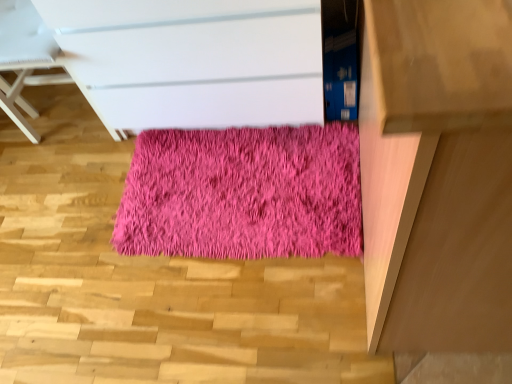
Question: Based on their sizes in the image, would you say shaggy pink rug at center is bigger or smaller than light brown wooden table at right?

Choices:
 (A) small
 (B) big

Answer: (A)

Question: From a real-world perspective, relative to light brown wooden table at right, is shaggy pink rug at center vertically above or below?

Choices:
 (A) below
 (B) above

Answer: (A)

Question: Which of these objects is positioned closest to the matte white chest of drawers at center?

Choices:
 (A) shaggy pink rug at center
 (B) pink fluffy rug at center
 (C) light brown wooden table at right

Answer: (A)

Question: Based on their relative distances, which object is nearer to the pink fluffy rug at center?

Choices:
 (A) light brown wooden table at right
 (B) matte white chest of drawers at center
 (C) shaggy pink rug at center

Answer: (C)